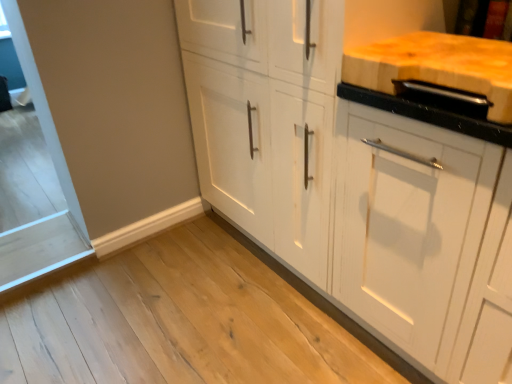
Question: Is natural wood cutting board at upper right bigger or smaller than white matte cabinet at center?

Choices:
 (A) big
 (B) small

Answer: (B)

Question: Considering their positions, is natural wood cutting board at upper right located in front of or behind white matte cabinet at center?

Choices:
 (A) behind
 (B) front

Answer: (B)

Question: Considering the relative positions of natural wood cutting board at upper right and white matte cabinet at center in the image provided, is natural wood cutting board at upper right to the left or to the right of white matte cabinet at center?

Choices:
 (A) left
 (B) right

Answer: (B)

Question: From their relative heights in the image, would you say white matte cabinet at center is taller or shorter than natural wood cutting board at upper right?

Choices:
 (A) short
 (B) tall

Answer: (B)

Question: Is white matte cabinet at center wider or thinner than natural wood cutting board at upper right?

Choices:
 (A) wide
 (B) thin

Answer: (A)

Question: Is white matte cabinet at center in front of or behind natural wood cutting board at upper right in the image?

Choices:
 (A) behind
 (B) front

Answer: (A)

Question: Considering the relative positions of white matte cabinet at center and natural wood cutting board at upper right in the image provided, is white matte cabinet at center to the left or to the right of natural wood cutting board at upper right?

Choices:
 (A) right
 (B) left

Answer: (B)